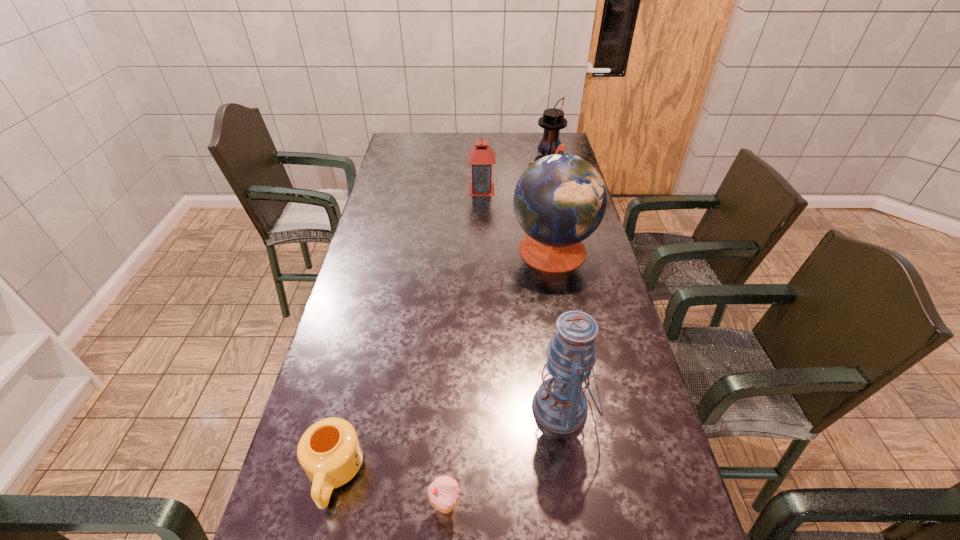
Locate an element on the screen. The width and height of the screenshot is (960, 540). free space that is in between the fourth tallest object and the nearest lantern is located at coordinates (522, 299).

Locate an element on the screen. This screenshot has width=960, height=540. vacant area between the third farthest object and the leftmost object is located at coordinates (444, 361).

You are a GUI agent. You are given a task and a screenshot of the screen. Output one action in this format:
    pyautogui.click(x=<x>, y=<y>)
    Task: Click on the object that can be found as the second closest to the farthest lantern
    The image size is (960, 540).
    Given the screenshot: What is the action you would take?
    pyautogui.click(x=560, y=200)

Select which object appears as the third closest to the third shortest object. Please provide its 2D coordinates. Your answer should be formatted as a tuple, i.e. [(x, y)], where the tuple contains the x and y coordinates of a point satisfying the conditions above.

[(560, 405)]

Where is `lantern that stands as the closest to the icecream`? lantern that stands as the closest to the icecream is located at coordinates (560, 405).

Locate an element on the screen. Image resolution: width=960 pixels, height=540 pixels. lantern that stands as the second closest to the leftmost object is located at coordinates (481, 157).

Locate an element on the screen. This screenshot has height=540, width=960. vacant space that satisfies the following two spatial constraints: 1. on the handle side of the mug; 2. on the left side of the icecream is located at coordinates (327, 507).

The width and height of the screenshot is (960, 540). I want to click on vacant area in the image that satisfies the following two spatial constraints: 1. on the handle side of the mug; 2. on the left side of the icecream, so click(x=327, y=507).

Where is `free spot that satisfies the following two spatial constraints: 1. on the handle side of the icecream; 2. on the right side of the mug`? This screenshot has height=540, width=960. free spot that satisfies the following two spatial constraints: 1. on the handle side of the icecream; 2. on the right side of the mug is located at coordinates (327, 507).